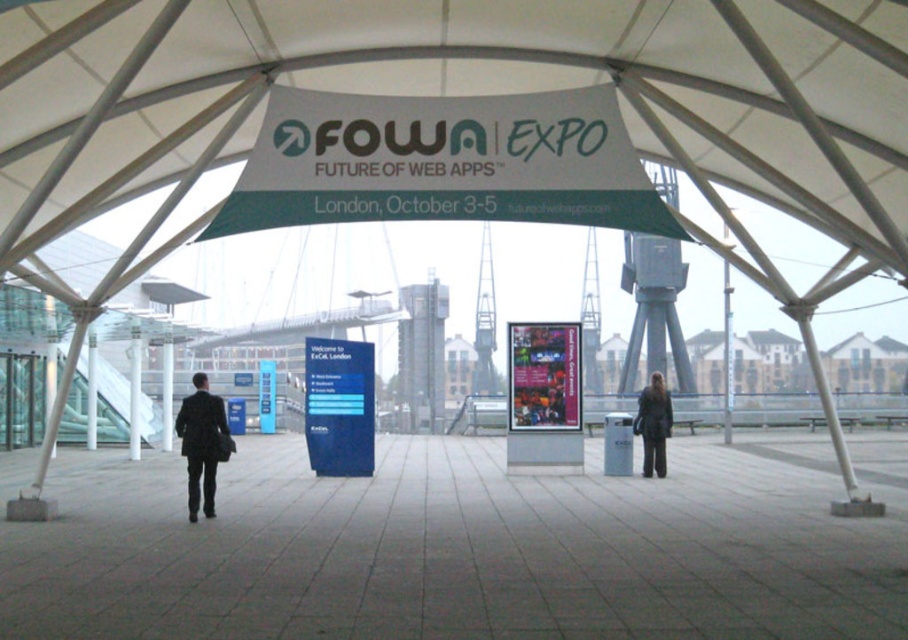
You are at the FOWA Expo and want to read both the blue plastic sign at center and the matte plastic poster at center. Which one do you need to get closer to in order to read?

The blue plastic sign at center is thinner than the matte plastic poster at center, so you need to get closer to the blue plastic sign at center to read it.

You are at the FOWA Expo event and want to read the text on the blue plastic sign at center. However, the dark brown leather jacket at lower right is blocking your view. Can you move around to see the sign?

The blue plastic sign at center is positioned under the dark brown leather jacket at lower right, so moving to the side or behind the jacket might allow you to see the sign.